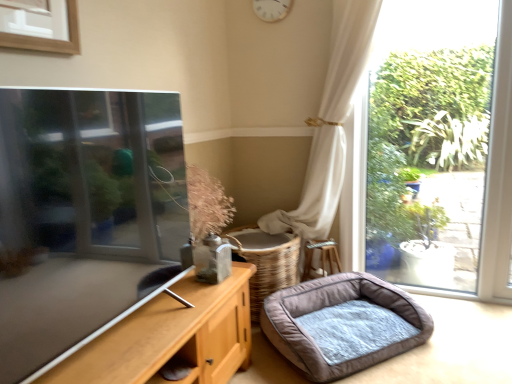
Question: Does white wooden clock at upper center touch gray plush dog bed at lower right?

Choices:
 (A) yes
 (B) no

Answer: (B)

Question: Is white wooden clock at upper center smaller than gray plush dog bed at lower right?

Choices:
 (A) yes
 (B) no

Answer: (A)

Question: From the image's perspective, does white wooden clock at upper center appear lower than gray plush dog bed at lower right?

Choices:
 (A) yes
 (B) no

Answer: (B)

Question: Is white wooden clock at upper center oriented towards gray plush dog bed at lower right?

Choices:
 (A) yes
 (B) no

Answer: (B)

Question: Considering the relative sizes of white wooden clock at upper center and gray plush dog bed at lower right in the image provided, is white wooden clock at upper center taller than gray plush dog bed at lower right?

Choices:
 (A) no
 (B) yes

Answer: (B)

Question: Is gray plush dog bed at lower right completely or partially inside white wooden clock at upper center?

Choices:
 (A) no
 (B) yes

Answer: (A)

Question: Can you confirm if gray plush dog bed at lower right is bigger than white wooden clock at upper center?

Choices:
 (A) yes
 (B) no

Answer: (A)

Question: From a real-world perspective, is gray plush dog bed at lower right physically above white wooden clock at upper center?

Choices:
 (A) no
 (B) yes

Answer: (A)

Question: From the image's perspective, is gray plush dog bed at lower right below white wooden clock at upper center?

Choices:
 (A) yes
 (B) no

Answer: (A)

Question: Does gray plush dog bed at lower right have a greater width compared to white wooden clock at upper center?

Choices:
 (A) no
 (B) yes

Answer: (B)

Question: Is gray plush dog bed at lower right outside white wooden clock at upper center?

Choices:
 (A) no
 (B) yes

Answer: (B)

Question: Is white wooden clock at upper center located within gray plush dog bed at lower right?

Choices:
 (A) yes
 (B) no

Answer: (B)

Question: Relative to gray plush dog bed at lower right, is white wooden clock at upper center in front or behind?

Choices:
 (A) behind
 (B) front

Answer: (A)